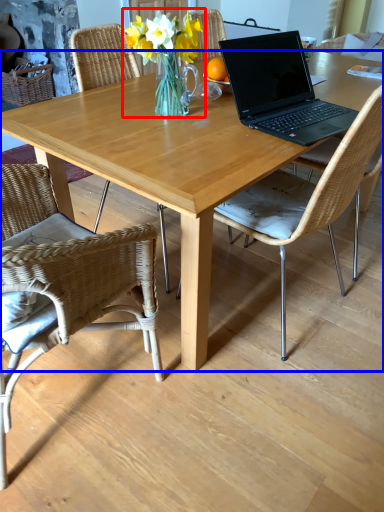
Question: Which of the following is the farthest to the observer, floral arrangement (highlighted by a red box) or desk (highlighted by a blue box)?

Choices:
 (A) floral arrangement
 (B) desk

Answer: (A)